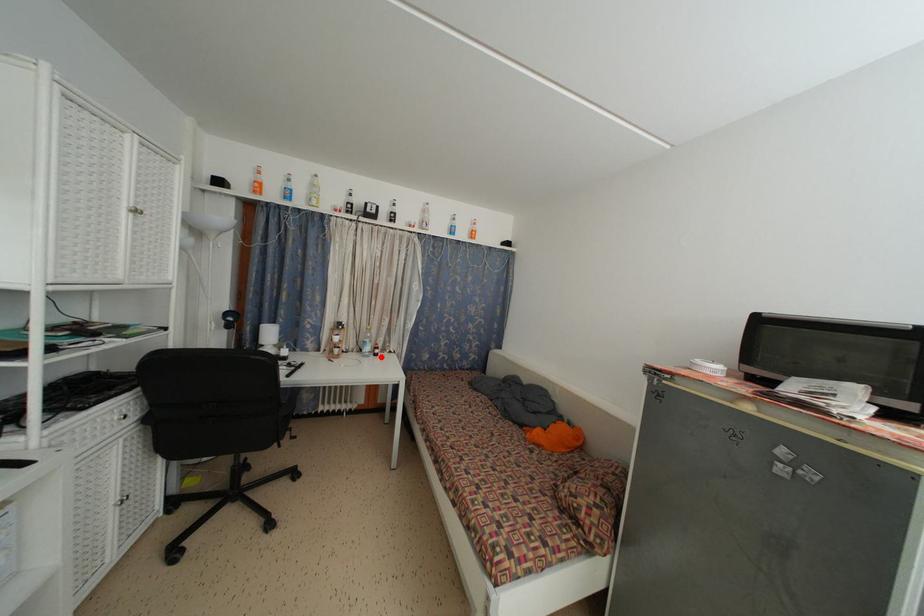
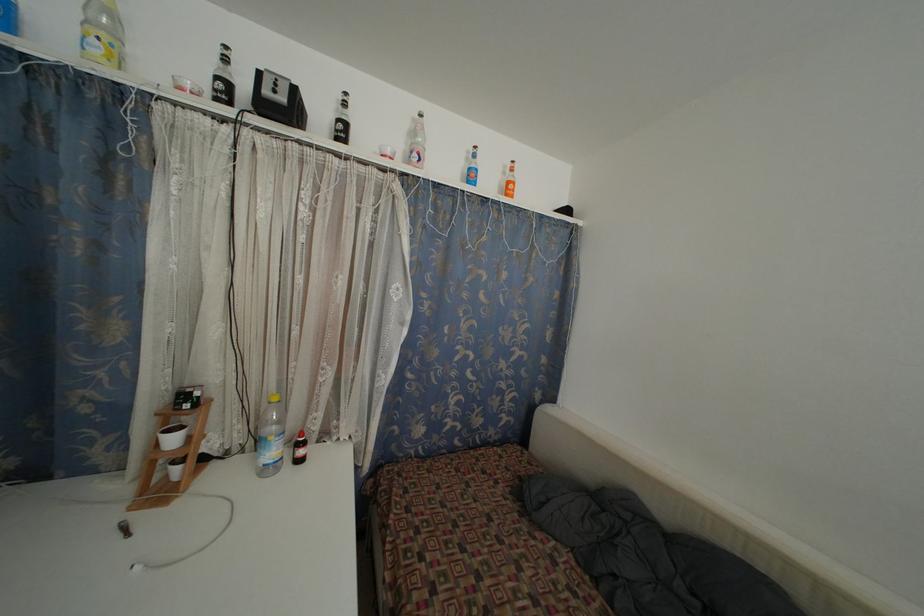
Where in the second image is the point corresponding to the highlighted location from the first image?

(305, 458)